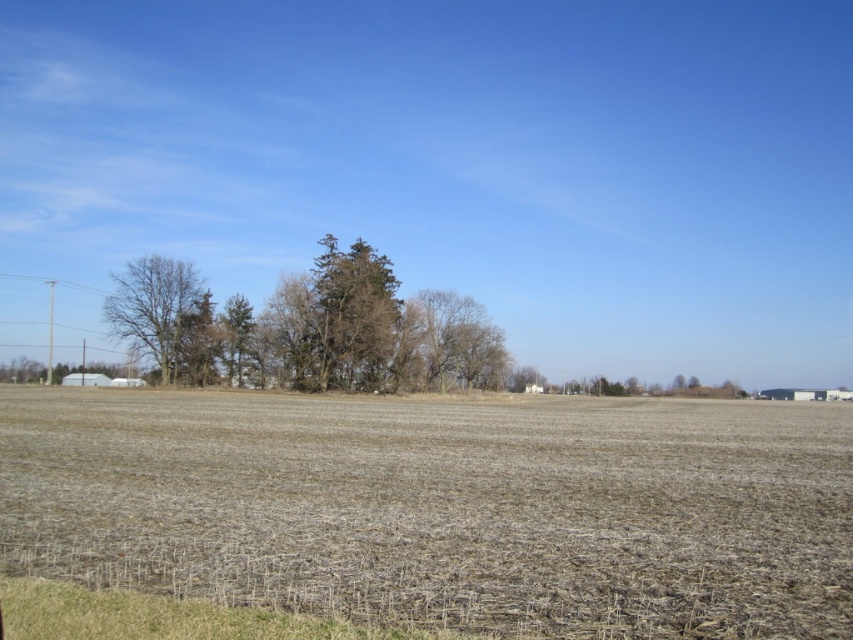
Is bare branches at left to the left of green textured tree at center from the viewer's perspective?

Indeed, bare branches at left is positioned on the left side of green textured tree at center.

Does bare branches at left have a greater height compared to green textured tree at center?

Yes.

Between point (132, 314) and point (247, 314), which one is positioned in front?

Point (132, 314) is more forward.

Locate an element on the screen. This screenshot has height=640, width=853. bare branches at left is located at coordinates (152, 307).

Does brown textured tree at center have a larger size compared to green textured tree at center?

No, brown textured tree at center is not bigger than green textured tree at center.

Measure the distance between brown textured tree at center and green textured tree at center.

The distance of brown textured tree at center from green textured tree at center is 12.30 meters.

Identify the location of brown textured tree at center. This screenshot has height=640, width=853. (346, 320).

Is brown dry grass at center above bare branches at left?

Actually, brown dry grass at center is below bare branches at left.

Can you confirm if brown dry grass at center is positioned to the right of bare branches at left?

Correct, you'll find brown dry grass at center to the right of bare branches at left.

Between point (480, 513) and point (172, 372), which one is positioned behind?

Positioned behind is point (172, 372).

Image resolution: width=853 pixels, height=640 pixels. I want to click on brown dry grass at center, so click(444, 508).